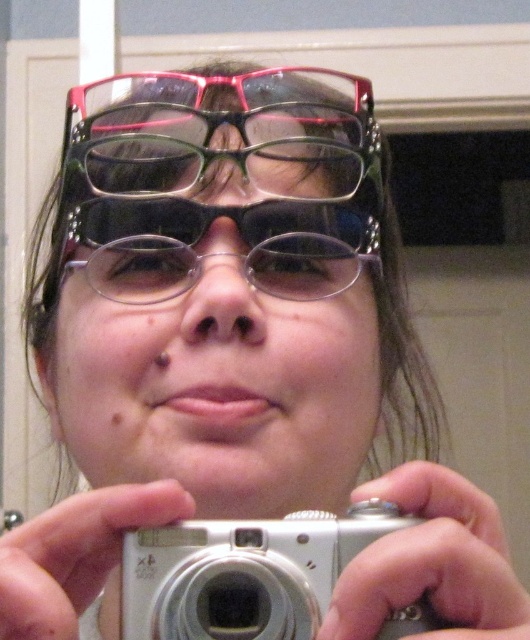
Can you confirm if transparent plastic glasses at center is positioned to the right of silver metallic camera at center?

Incorrect, transparent plastic glasses at center is not on the right side of silver metallic camera at center.

Can you confirm if transparent plastic glasses at center is thinner than silver metallic camera at center?

No, transparent plastic glasses at center is not thinner than silver metallic camera at center.

What do you see at coordinates (216, 173) in the screenshot?
I see `transparent plastic glasses at center` at bounding box center [216, 173].

You are a GUI agent. You are given a task and a screenshot of the screen. Output one action in this format:
    pyautogui.click(x=<x>, y=<y>)
    Task: Click on the transparent plastic glasses at center
    
    Given the screenshot: What is the action you would take?
    pyautogui.click(x=216, y=173)